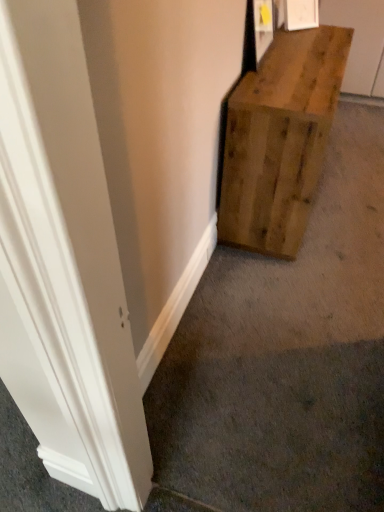
Question: From their relative heights in the image, would you say natural wood bench at right is taller or shorter than natural wood crate at center-right?

Choices:
 (A) tall
 (B) short

Answer: (B)

Question: Do you think natural wood bench at right is within natural wood crate at center-right, or outside of it?

Choices:
 (A) outside
 (B) inside

Answer: (A)

Question: Relative to natural wood crate at center-right, is natural wood bench at right in front or behind?

Choices:
 (A) behind
 (B) front

Answer: (A)

Question: Is point (266, 366) positioned closer to the camera than point (329, 48)?

Choices:
 (A) closer
 (B) farther

Answer: (A)

Question: Considering the positions of natural wood crate at center-right and natural wood bench at right in the image, is natural wood crate at center-right taller or shorter than natural wood bench at right?

Choices:
 (A) tall
 (B) short

Answer: (A)

Question: Relative to natural wood bench at right, is natural wood crate at center-right in front or behind?

Choices:
 (A) behind
 (B) front

Answer: (B)

Question: Is natural wood crate at center-right to the left or to the right of natural wood bench at right in the image?

Choices:
 (A) left
 (B) right

Answer: (A)